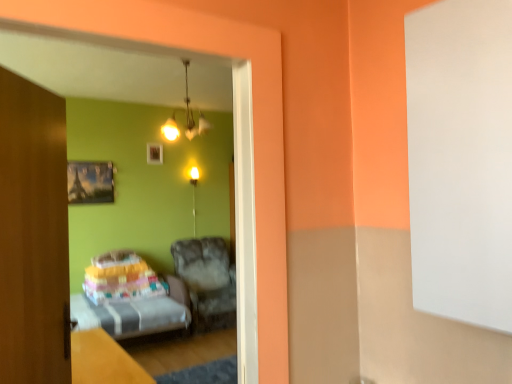
Question: Is transparent glass door at left wider or thinner than metallic silver picture frame at upper left, placed as the second picture frame when sorted from right to left?

Choices:
 (A) wide
 (B) thin

Answer: (A)

Question: From the image's perspective, is transparent glass door at left positioned above or below metallic silver picture frame at upper left, which is the 1th picture frame from bottom to top?

Choices:
 (A) above
 (B) below

Answer: (B)

Question: Which is farther from the matte white chandelier at upper center?

Choices:
 (A) wooden picture frame at upper center, the first picture frame when ordered from right to left
 (B) fuzzy fabric armchair at center, the 1th furniture when ordered from right to left
 (C) metallic silver picture frame at upper left, which is the 1th picture frame from bottom to top
 (D) wooden door at left
 (E) transparent glass door at left

Answer: (D)

Question: Estimate the real-world distances between objects in this image. Which object is closer to the matte gold light fixture at center?

Choices:
 (A) transparent glass door at left
 (B) metallic silver picture frame at upper left, placed as the second picture frame when sorted from right to left
 (C) multicolored fabric bed at lower left, the second furniture from the right
 (D) wooden door at left
 (E) wooden table at lower left

Answer: (B)